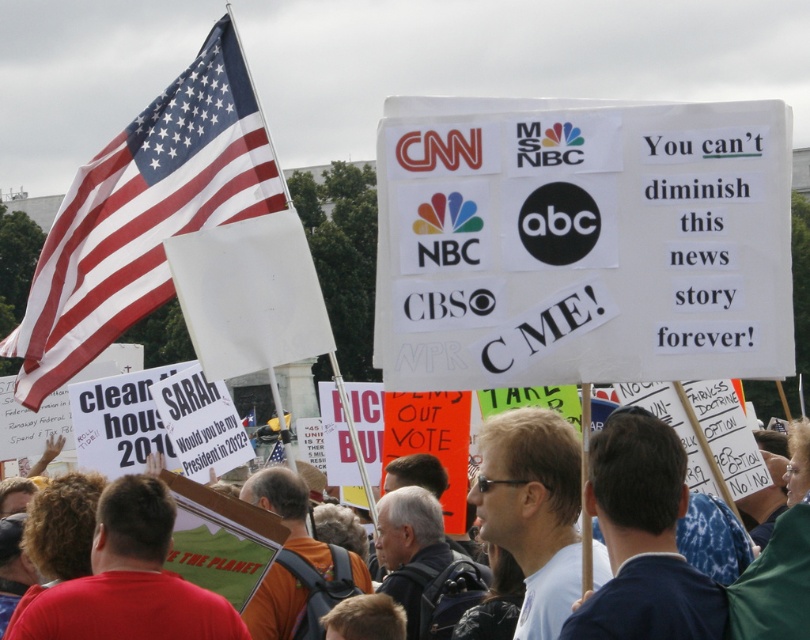
You are a photographer standing at the center of the protest scene. You notice two points marked in the image. Which point is closer to you, point at (698, 237) or point at (712, 586)?

Point at (698, 237) is further to the viewer than point at (712, 586), so the closer point is point at (712, 586).

You are a photographer trying to capture a clear shot of the white paper sign at center and the blue fabric shirt at center. Which object is closer to the camera?

The white paper sign at center is closer to the camera because it is in front of the blue fabric shirt at center.